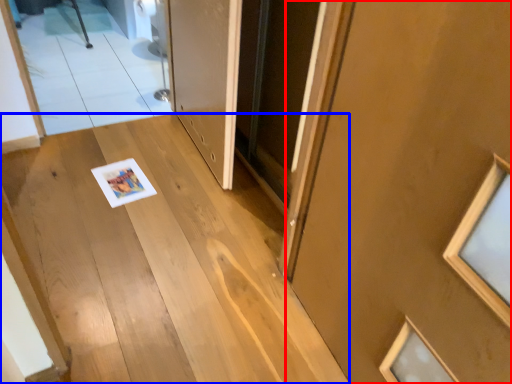
Question: Which object is further to the camera taking this photo, door (highlighted by a red box) or stairs (highlighted by a blue box)?

Choices:
 (A) door
 (B) stairs

Answer: (B)